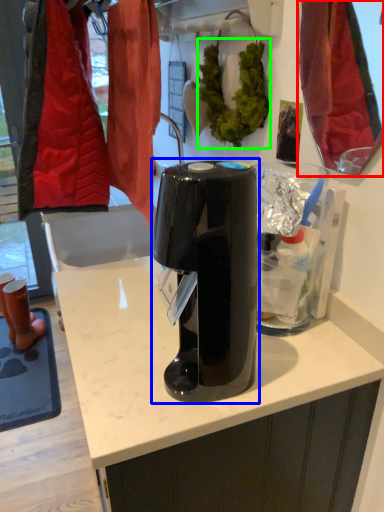
Question: Estimate the real-world distances between objects in this image. Which object is farther from mirror (highlighted by a red box), home appliance (highlighted by a blue box) or plant (highlighted by a green box)?

Choices:
 (A) home appliance
 (B) plant

Answer: (A)